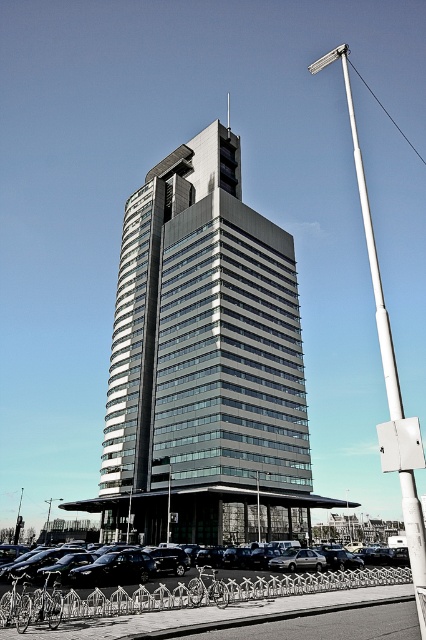
Question: Based on their relative distances, which object is farther from the black asphalt parking lot at lower center?

Choices:
 (A) metallic silver car at center
 (B) metallic glass tower at center

Answer: (B)

Question: Which of these objects is positioned farthest from the black asphalt parking lot at lower center?

Choices:
 (A) metallic glass tower at center
 (B) metallic silver car at center

Answer: (A)

Question: Among these objects, which one is nearest to the camera?

Choices:
 (A) metallic glass tower at center
 (B) metallic silver car at center
 (C) black asphalt parking lot at lower center

Answer: (C)

Question: Does metallic glass tower at center appear on the left side of black asphalt parking lot at lower center?

Choices:
 (A) yes
 (B) no

Answer: (A)

Question: Does black asphalt parking lot at lower center have a larger size compared to metallic silver car at center?

Choices:
 (A) yes
 (B) no

Answer: (B)

Question: Is metallic glass tower at center bigger than black asphalt parking lot at lower center?

Choices:
 (A) no
 (B) yes

Answer: (B)